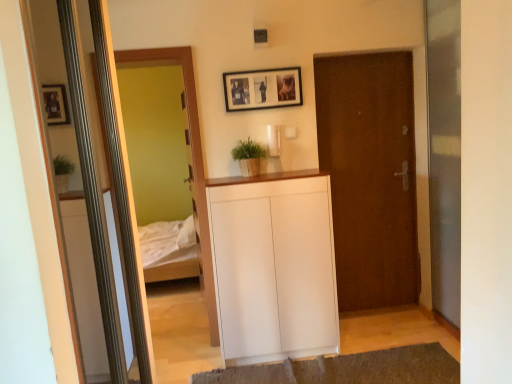
Question: From a real-world perspective, is white matte cabinet at center above or below wooden framed mirror at left?

Choices:
 (A) above
 (B) below

Answer: (B)

Question: Is point (236, 210) closer or farther from the camera than point (128, 51)?

Choices:
 (A) farther
 (B) closer

Answer: (B)

Question: Based on their relative distances, which object is farther from the white matte cabinet at center?

Choices:
 (A) brown matte door at center
 (B) green matte plant at center
 (C) brown textured rug at lower center
 (D) wooden framed mirror at left
 (E) wooden framed photo at upper center

Answer: (E)

Question: Estimate the real-world distances between objects in this image. Which object is farther from the brown textured rug at lower center?

Choices:
 (A) wooden framed mirror at left
 (B) brown matte door at center
 (C) green matte plant at center
 (D) wooden framed photo at upper center
 (E) transparent glass screen door at right

Answer: (D)